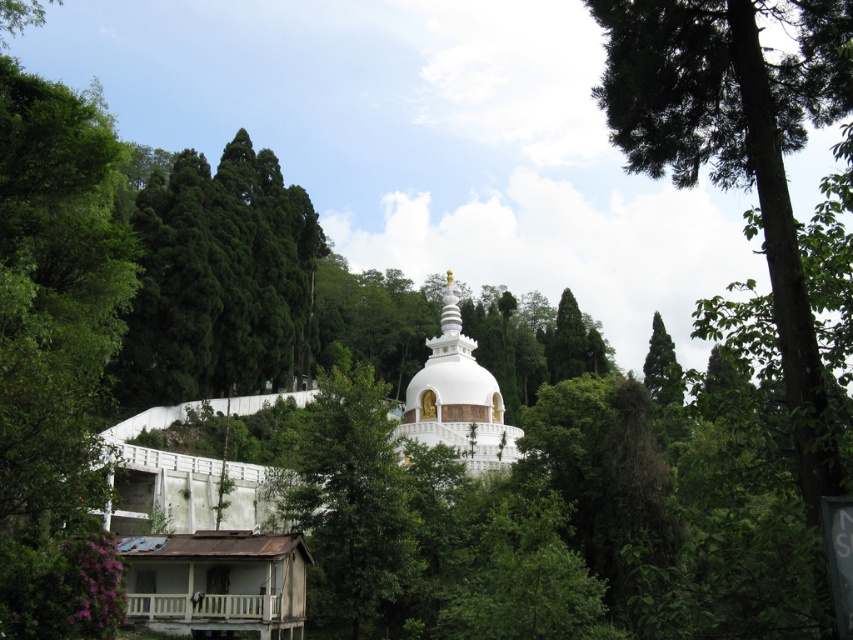
You are a photographer planning to capture the white glossy stupa at center and the green glossy tree at upper left in a single shot. Based on their sizes, which one should you focus on to ensure both are clearly visible in the frame?

The green glossy tree at upper left is bigger than the white glossy stupa at center, so focusing on the tree will help ensure both are clearly visible in the frame since it occupies more space.

Based on the scene description, which of the two trees, the green leafy tree at upper center or the green glossy tree at upper left, is shorter?

The green leafy tree at upper center is shorter than the green glossy tree at upper left.